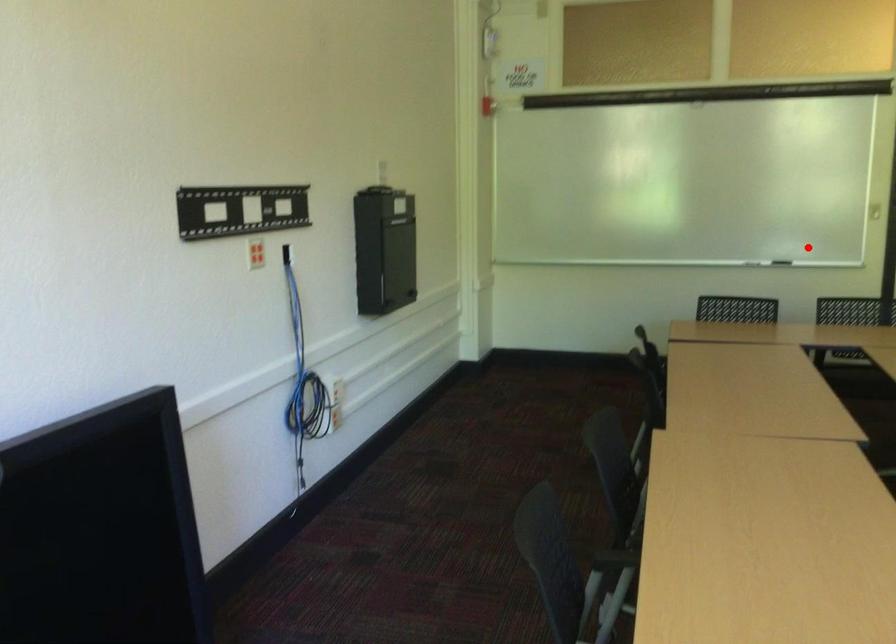
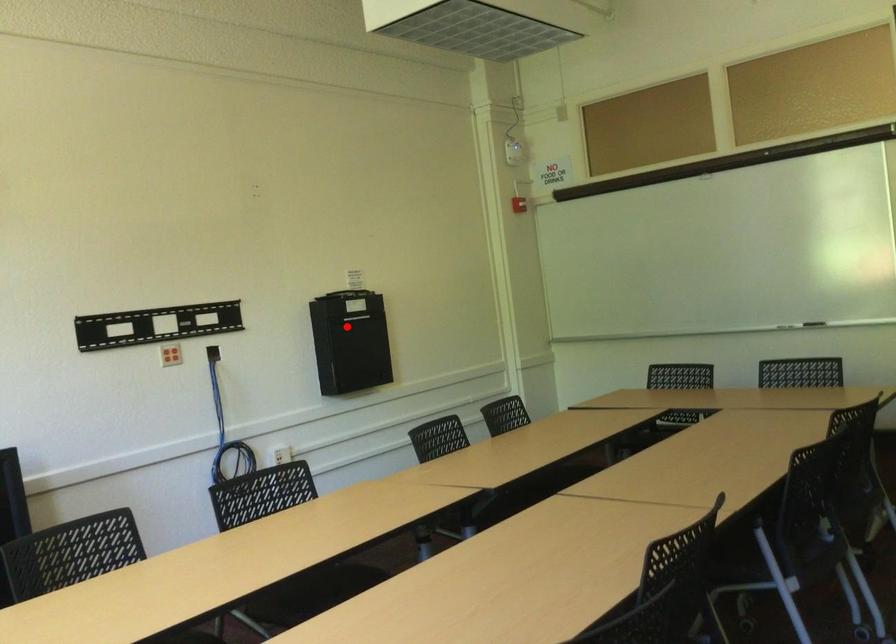
I am providing you with two images of the same scene from different viewpoints. A red point is marked on the first image and another point is marked on the second image. Do the highlighted points in image1 and image2 indicate the same real-world spot?

No